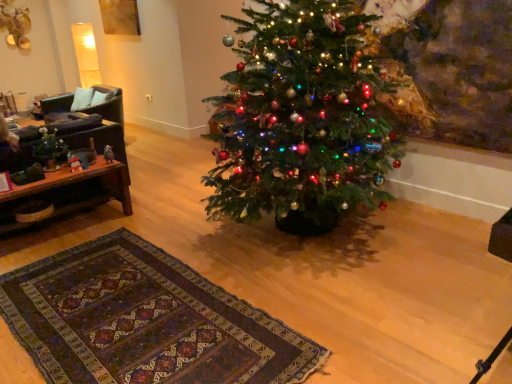
Question: Is point (104, 87) closer or farther from the camera than point (2, 230)?

Choices:
 (A) farther
 (B) closer

Answer: (A)

Question: Based on their sizes in the image, would you say black leather armchair at left is bigger or smaller than brown wooden table at left?

Choices:
 (A) small
 (B) big

Answer: (B)

Question: Estimate the real-world distances between objects in this image. Which object is farther from the black leather armchair at left?

Choices:
 (A) matte black vase at left
 (B) brown wooden table at left

Answer: (B)

Question: Which object is positioned closest to the black leather armchair at left?

Choices:
 (A) matte black vase at left
 (B) brown wooden table at left

Answer: (A)